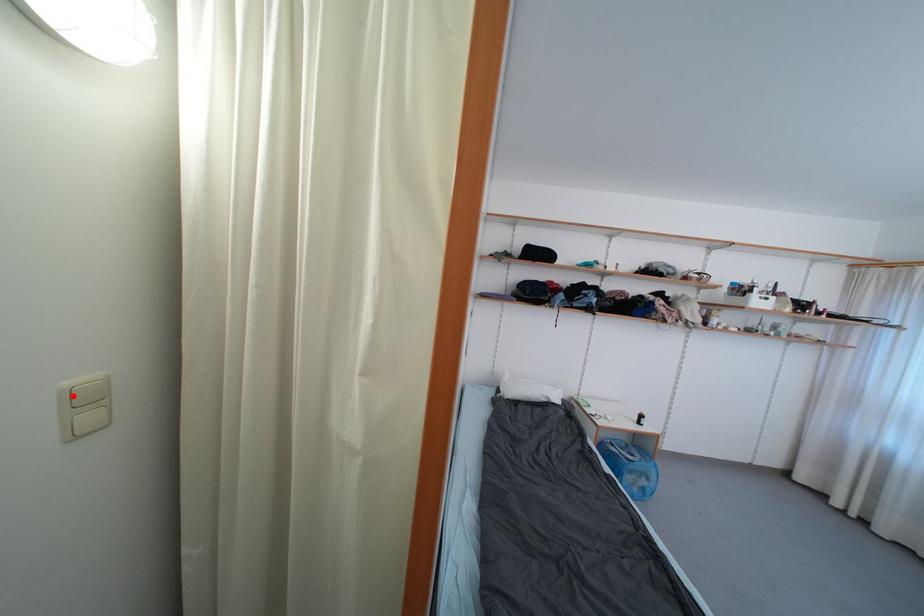
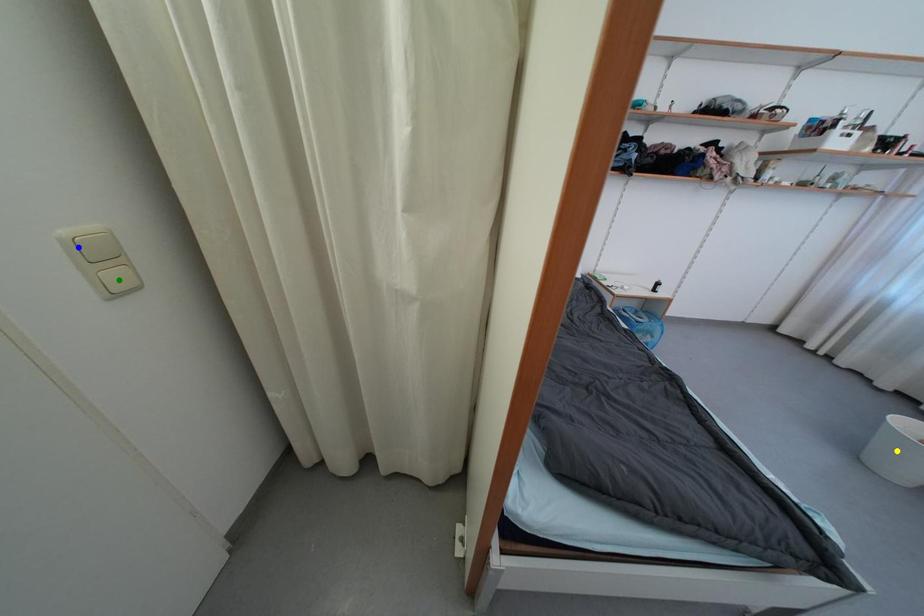
Question: I am providing you with two images of the same scene from different viewpoints. A red point is marked on the first image. You are given multiple points on the second image. Can you choose the point in image 2 that corresponds to the point in image 1?

Choices:
 (A) yellow point
 (B) blue point
 (C) green point

Answer: (B)